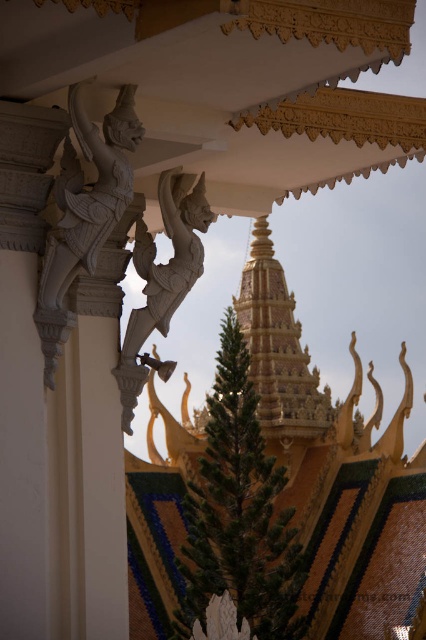
Which is above, gold textured spire at center or white stone statue at center?

white stone statue at center is above.

Can you confirm if gold textured spire at center is positioned to the left of white stone statue at center?

Incorrect, gold textured spire at center is not on the left side of white stone statue at center.

Between point (242, 307) and point (152, 308), which one is positioned in front?

Point (152, 308) is more forward.

Where is `gold textured spire at center`? This screenshot has width=426, height=640. gold textured spire at center is located at coordinates (278, 348).

Based on the photo, who is taller, white stone statue at upper left or white stone statue at center?

Standing taller between the two is white stone statue at upper left.

Is white stone statue at upper left positioned behind white stone statue at center?

No.

Is point (60, 221) positioned after point (187, 273)?

No, (60, 221) is in front of (187, 273).

The height and width of the screenshot is (640, 426). What are the coordinates of `white stone statue at upper left` in the screenshot? It's located at (83, 212).

Is white stone statue at upper left bigger than gold textured spire at center?

No.

This screenshot has height=640, width=426. What do you see at coordinates (83, 212) in the screenshot?
I see `white stone statue at upper left` at bounding box center [83, 212].

Between point (60, 264) and point (199, 413), which one is positioned behind?

Positioned behind is point (199, 413).

I want to click on white stone statue at upper left, so click(83, 212).